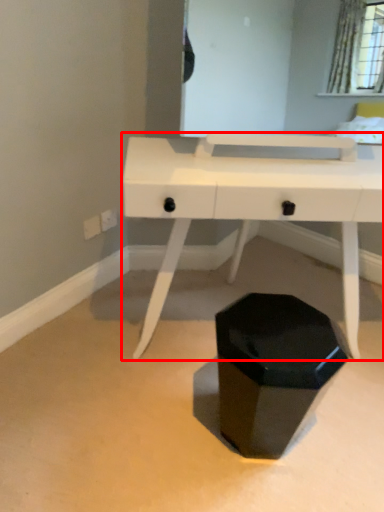
Question: Where is desk (annotated by the red box) located in relation to waste container in the image?

Choices:
 (A) right
 (B) left

Answer: (A)